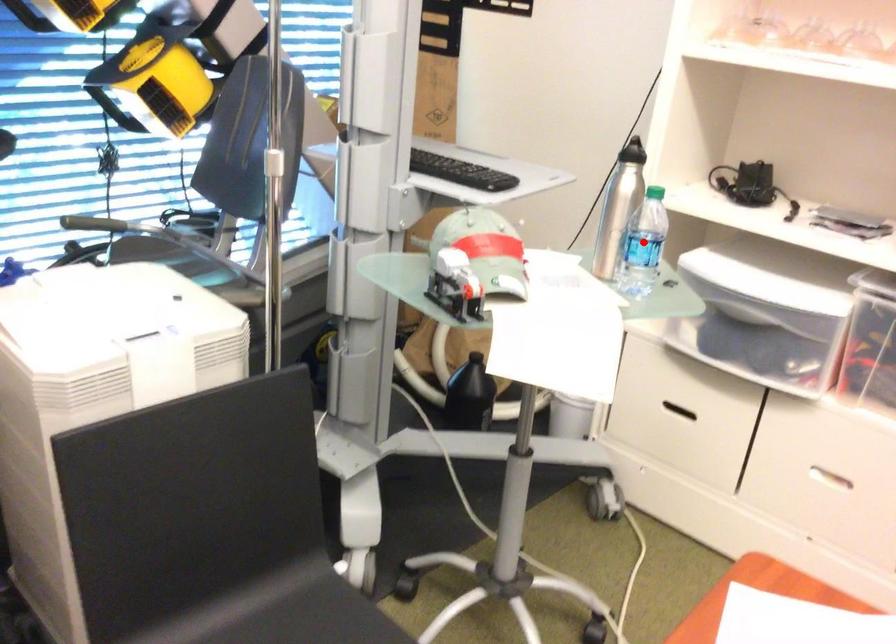
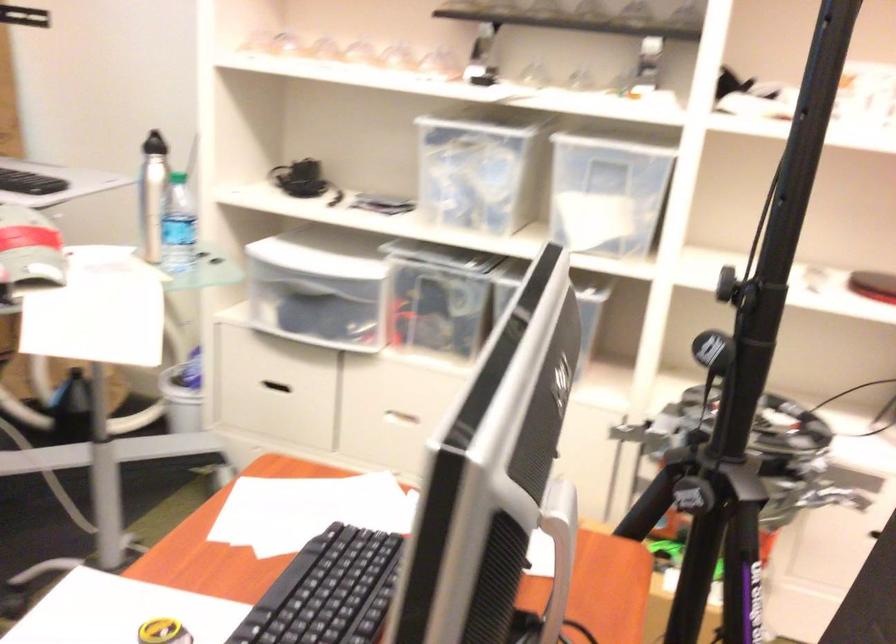
Find the pixel in the second image that matches the highlighted location in the first image.

(177, 225)